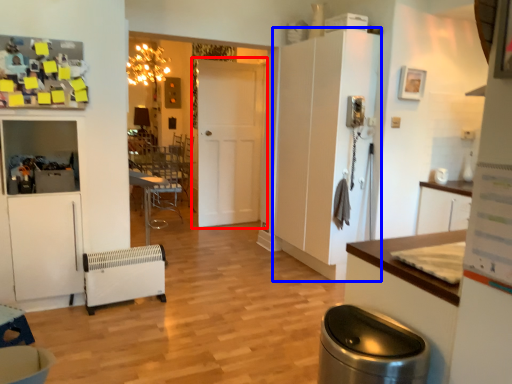
Question: Among these objects, which one is farthest to the camera, door (highlighted by a red box) or cabinetry (highlighted by a blue box)?

Choices:
 (A) door
 (B) cabinetry

Answer: (A)